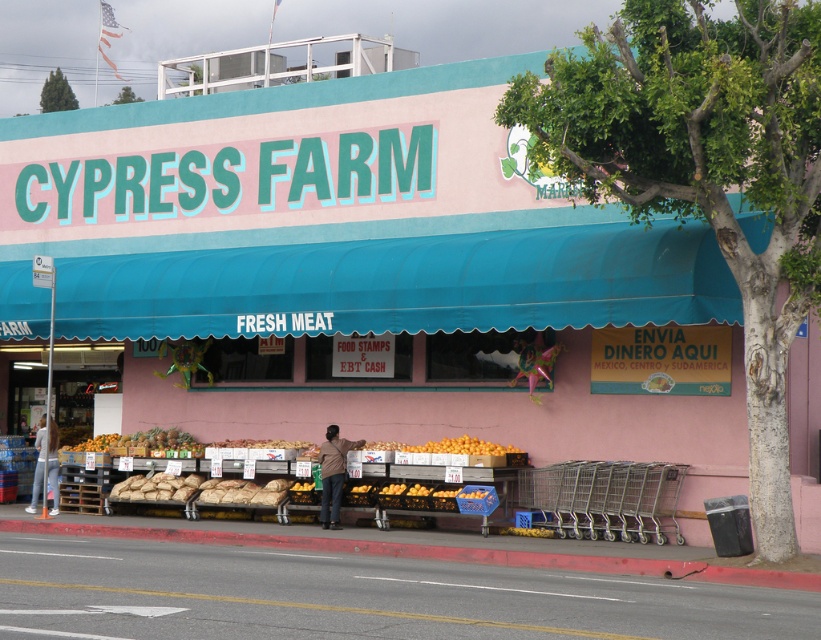
Question: Which object appears closest to the camera in this image?

Choices:
 (A) orange matte at center
 (B) shiny golden pineapple at center
 (C) orange matte fruit at center

Answer: (C)

Question: Does orange matte fruit at center have a lesser width compared to orange matte at center?

Choices:
 (A) no
 (B) yes

Answer: (A)

Question: Which point appears farthest from the camera in this image?

Choices:
 (A) (152, 445)
 (B) (507, 451)
 (C) (673, 467)

Answer: (A)

Question: Which point is closer to the camera?

Choices:
 (A) (647, 538)
 (B) (200, 456)

Answer: (A)

Question: Can you confirm if orange matte fruit at center is positioned to the left of orange matte at center?

Choices:
 (A) no
 (B) yes

Answer: (A)

Question: Can you confirm if shiny golden pineapple at center is positioned to the left of orange matte at center?

Choices:
 (A) no
 (B) yes

Answer: (B)